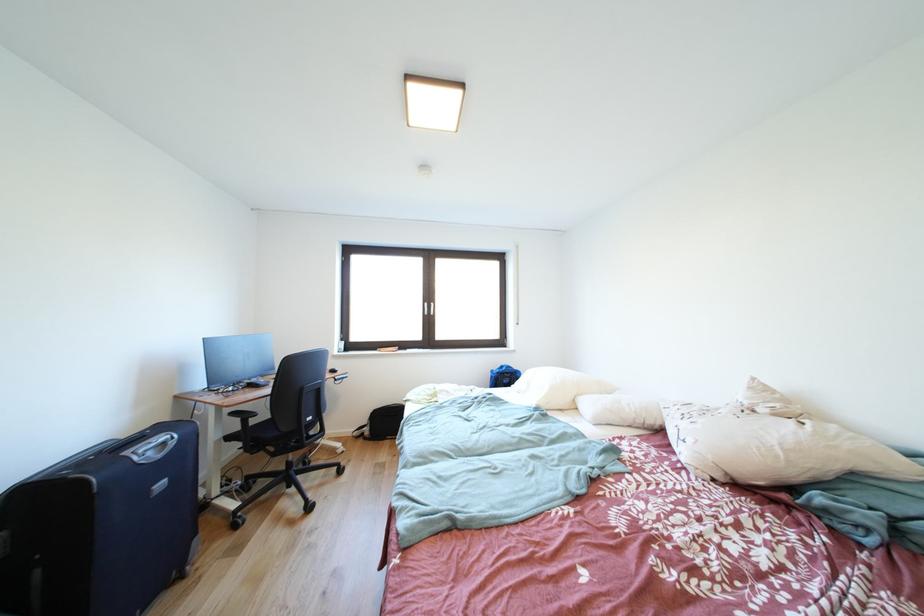
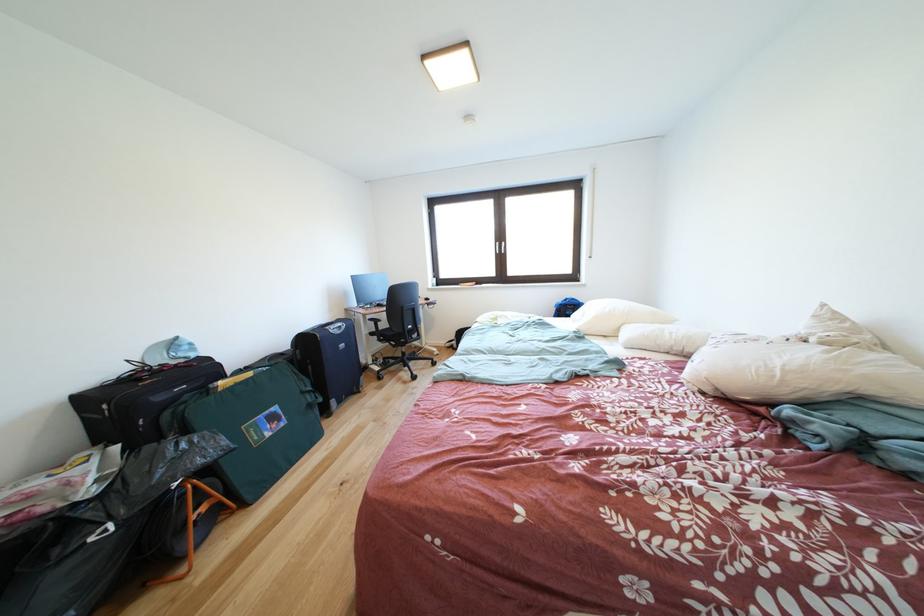
In the second image, find the point that corresponds to (x=727, y=482) in the first image.

(716, 394)